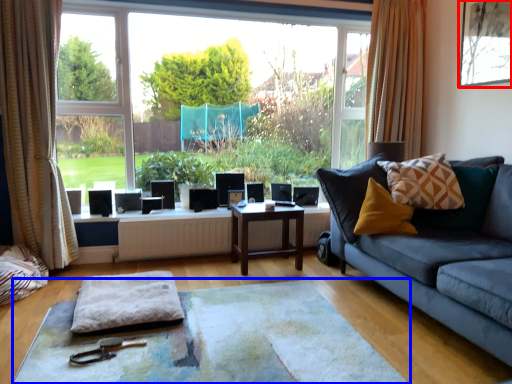
Question: Which point is further to the camera, picture frame (highlighted by a red box) or flat (highlighted by a blue box)?

Choices:
 (A) picture frame
 (B) flat

Answer: (A)